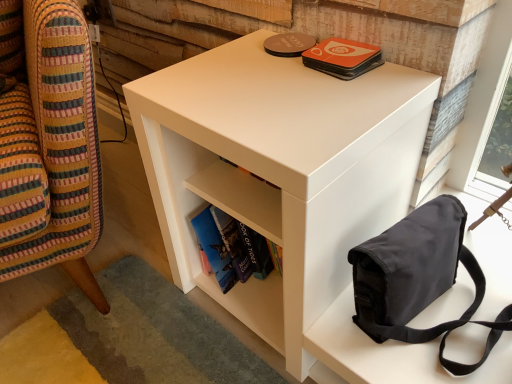
Question: In the image, is white matte nightstand at center on the left side or the right side of black canvas bag at upper right?

Choices:
 (A) right
 (B) left

Answer: (B)

Question: Choose the correct answer: Is white matte nightstand at center inside black canvas bag at upper right or outside it?

Choices:
 (A) inside
 (B) outside

Answer: (B)

Question: Which of these objects is positioned farthest from the white matte bookshelf at center?

Choices:
 (A) white matte nightstand at center
 (B) orange matte coaster at upper center
 (C) black canvas bag at upper right
 (D) white matte side table at lower right

Answer: (D)

Question: Considering the real-world distances, which object is farthest from the white matte side table at lower right?

Choices:
 (A) white matte bookshelf at center
 (B) black canvas bag at upper right
 (C) orange matte coaster at upper center
 (D) white matte nightstand at center

Answer: (B)